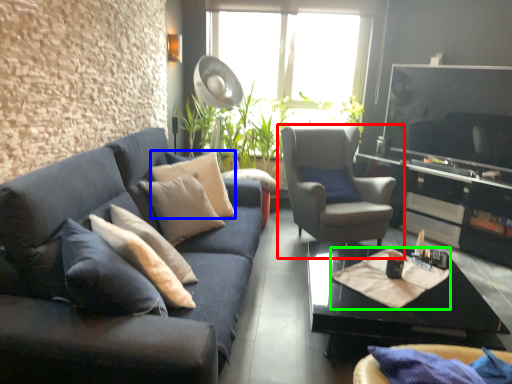
Question: Which object is the farthest from chair (highlighted by a red box)? Choose among these: pillow (highlighted by a blue box) or material (highlighted by a green box).

Choices:
 (A) pillow
 (B) material

Answer: (A)